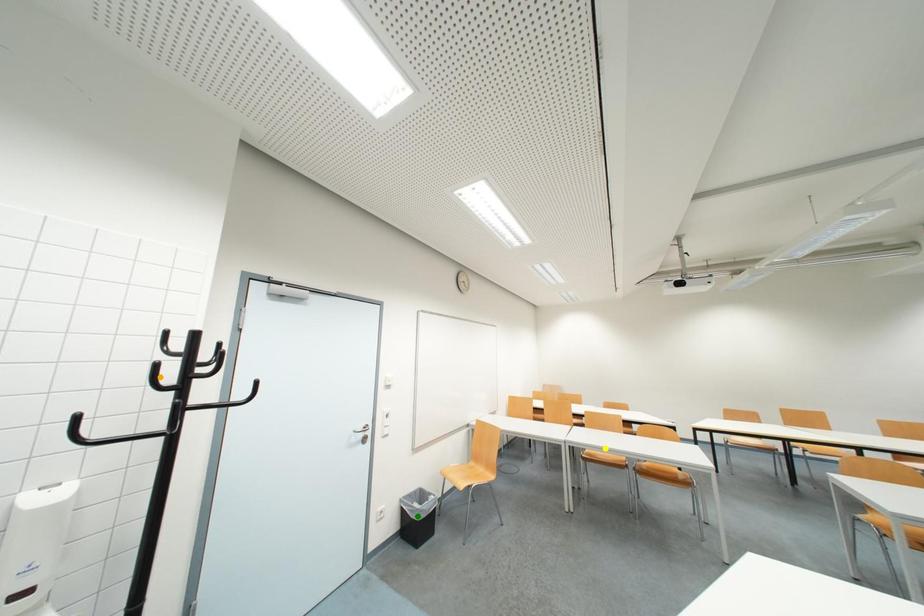
Order these from nearest to farthest:
- yellow point
- green point
- orange point

orange point → green point → yellow point